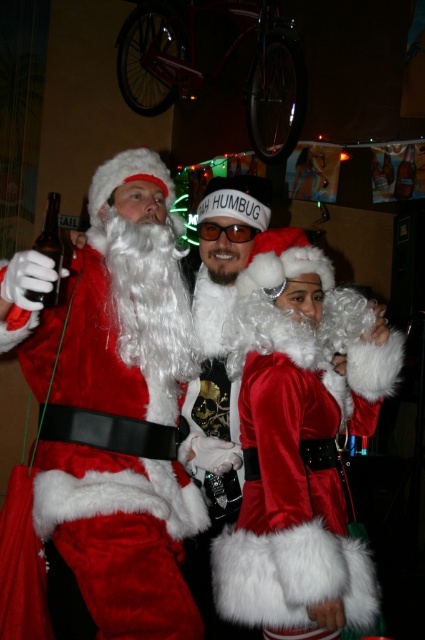
You are a photographer at the event and need to adjust your camera to capture both the brown glass bottle at left and the clear glass bottle at upper right in the same frame. Given the camera has a maximum focus range of 2.5 meters, will both bottles be in focus?

The distance between the brown glass bottle at left and the clear glass bottle at upper right is 2.49 meters, which is within the camera maximum focus range of 2.5 meters. Therefore, both bottles will be in focus.

You are a photographer at a holiday party and need to adjust the lighting so that both the brown glass bottle at left and the clear glass bottle at upper right are equally visible. Which bottle should you focus on first to ensure proper exposure?

The brown glass bottle at left is located below the clear glass bottle at upper right. Since the clear glass bottle at upper right is higher up, you should focus on it first to account for the lighting differences caused by its position in the frame.